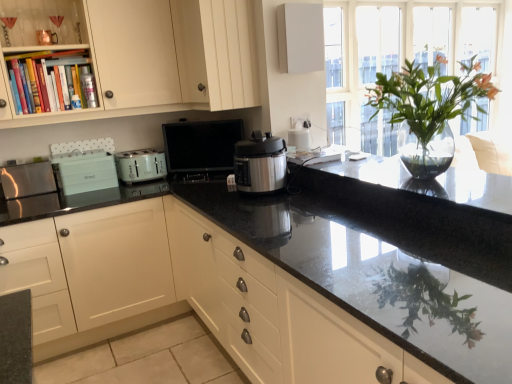
Question: Could you tell me if matte white cabinet at center, which is counted as the 1th cabinetry, starting from the bottom, is turned towards clear glass vase at upper right?

Choices:
 (A) yes
 (B) no

Answer: (A)

Question: Is matte white cabinet at center, arranged as the second cabinetry when viewed from the top, wider than clear glass vase at upper right?

Choices:
 (A) no
 (B) yes

Answer: (B)

Question: Can you confirm if matte white cabinet at center, arranged as the second cabinetry when viewed from the top, is bigger than clear glass vase at upper right?

Choices:
 (A) no
 (B) yes

Answer: (B)

Question: Can you confirm if matte white cabinet at center, which is counted as the 1th cabinetry, starting from the bottom, is positioned to the right of clear glass vase at upper right?

Choices:
 (A) yes
 (B) no

Answer: (B)

Question: From the image's perspective, is matte white cabinet at center, which is counted as the 1th cabinetry, starting from the bottom, beneath clear glass vase at upper right?

Choices:
 (A) no
 (B) yes

Answer: (B)

Question: Is black granite countertop at center, arranged as the second countertop when ordered from the bottom, inside the boundaries of brushed metal toaster at left, positioned as the first appliance in left-to-right order, or outside?

Choices:
 (A) outside
 (B) inside

Answer: (A)

Question: Is point (466, 180) closer or farther from the camera than point (17, 173)?

Choices:
 (A) closer
 (B) farther

Answer: (B)

Question: From the image's perspective, is black granite countertop at center, which ranks as the 1th countertop in top-to-bottom order, located above or below brushed metal toaster at left, positioned as the first appliance in left-to-right order?

Choices:
 (A) below
 (B) above

Answer: (A)

Question: Is black granite countertop at center, arranged as the second countertop when ordered from the bottom, bigger or smaller than brushed metal toaster at left, acting as the 3th appliance starting from the right?

Choices:
 (A) big
 (B) small

Answer: (A)

Question: Is black granite countertop at center, arranged as the second countertop when ordered from the bottom, inside or outside of matte green toaster at center?

Choices:
 (A) inside
 (B) outside

Answer: (B)

Question: From the image's perspective, is black granite countertop at center, which ranks as the 1th countertop in top-to-bottom order, located above or below matte green toaster at center?

Choices:
 (A) above
 (B) below

Answer: (B)

Question: From their relative heights in the image, would you say black granite countertop at center, which ranks as the 1th countertop in top-to-bottom order, is taller or shorter than matte green toaster at center?

Choices:
 (A) tall
 (B) short

Answer: (B)

Question: Based on their sizes in the image, would you say black granite countertop at center, which ranks as the 1th countertop in top-to-bottom order, is bigger or smaller than matte green toaster at center?

Choices:
 (A) big
 (B) small

Answer: (A)

Question: Considering the positions of matte green toaster at center and matte teal toaster at left, which is counted as the 2th appliance, starting from the left, in the image, is matte green toaster at center bigger or smaller than matte teal toaster at left, which is counted as the 2th appliance, starting from the left,?

Choices:
 (A) big
 (B) small

Answer: (B)

Question: From the image's perspective, is matte green toaster at center above or below matte teal toaster at left, positioned as the 2th appliance in right-to-left order?

Choices:
 (A) below
 (B) above

Answer: (B)